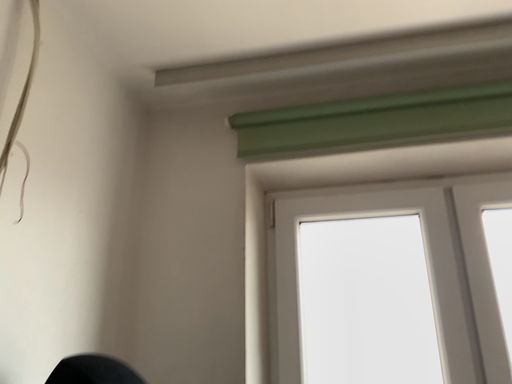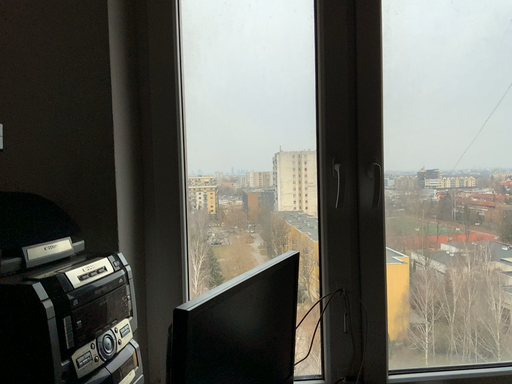
Question: Which way did the camera rotate in the video?

Choices:
 (A) rotated left
 (B) rotated right

Answer: (B)